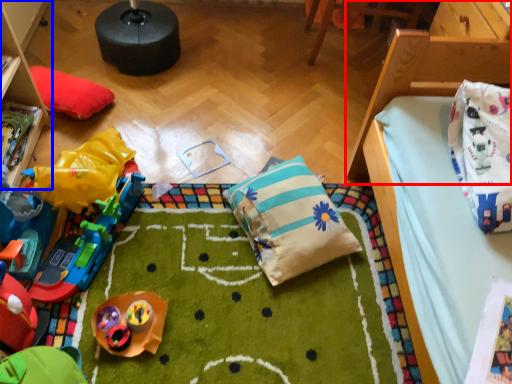
Question: Which of the following is the farthest to the observer, furniture (highlighted by a red box) or furniture (highlighted by a blue box)?

Choices:
 (A) furniture
 (B) furniture

Answer: (B)